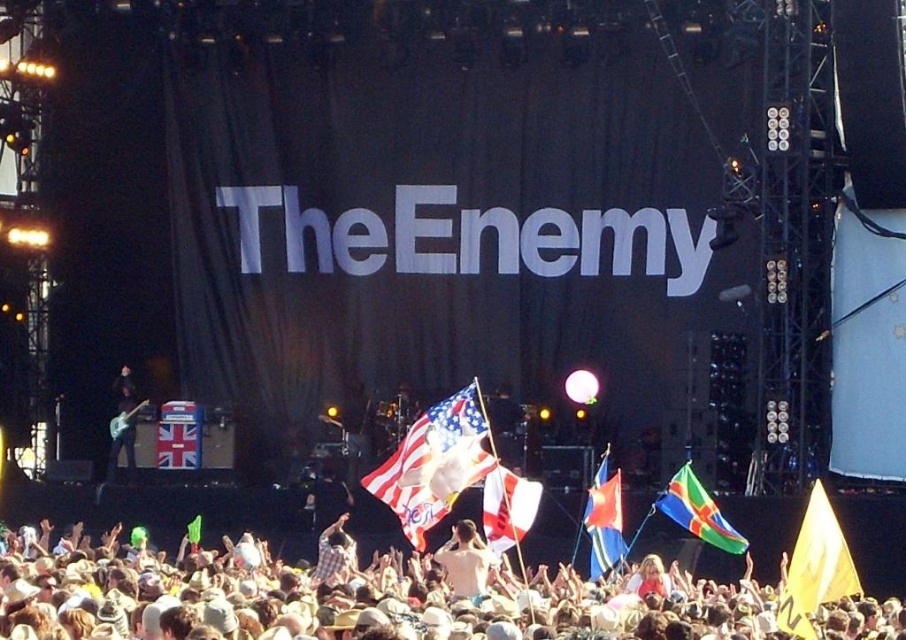
You are a photographer at the concert trying to capture the stage backdrop. You notice two flags in the center of the image. Which flag is positioned lower between the yellow fabric flag at center and the white fabric flag at center?

The yellow fabric flag at center is positioned below the white fabric flag at center, so it is lower.

You are at a concert and want to take a photo of the american flag at center and the plaid shirt at center. Which object should you zoom in on to ensure both are clearly visible in the photo?

The plaid shirt at center is smaller than the american flag at center, so you should zoom in on the plaid shirt at center to ensure both are clearly visible in the photo.

You are a photographer at the concert. You want to capture a closeup shot of the blue fabric flag at center without any obstructions. Given that your camera has a maximum zoom range of 50 meters, can you achieve this?

The distance between the blue fabric flag at center and the camera is 67.64 meters, which exceeds the camera maximum zoom range of 50 meters. Therefore, you cannot capture a closeup shot of the blue fabric flag at center without obstructions.